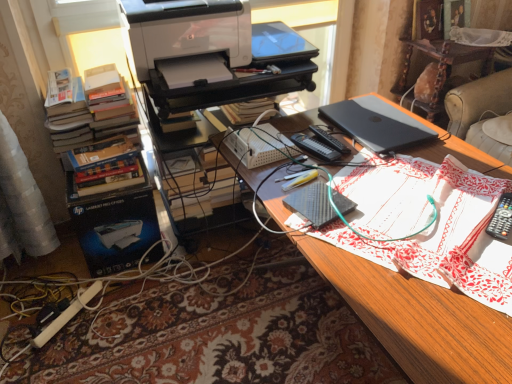
Question: From a real-world perspective, is white matte printer at upper left below black textured notebook at center?

Choices:
 (A) yes
 (B) no

Answer: (B)

Question: Are white matte printer at upper left and black textured notebook at center located far from each other?

Choices:
 (A) yes
 (B) no

Answer: (B)

Question: From the image's perspective, would you say white matte printer at upper left is positioned over black textured notebook at center?

Choices:
 (A) no
 (B) yes

Answer: (B)

Question: From the image's perspective, is white matte printer at upper left under black textured notebook at center?

Choices:
 (A) no
 (B) yes

Answer: (A)

Question: Is black textured notebook at center a part of white matte printer at upper left?

Choices:
 (A) no
 (B) yes

Answer: (A)

Question: Based on their positions, is black matte laptop at upper right located to the left or right of black textured notebook at center?

Choices:
 (A) right
 (B) left

Answer: (A)

Question: Considering their positions, is black matte laptop at upper right located in front of or behind black textured notebook at center?

Choices:
 (A) front
 (B) behind

Answer: (B)

Question: Is point (351, 124) closer or farther from the camera than point (290, 193)?

Choices:
 (A) farther
 (B) closer

Answer: (A)

Question: From the image's perspective, is black matte laptop at upper right above or below black textured notebook at center?

Choices:
 (A) below
 (B) above

Answer: (B)

Question: Is black plastic laptop at upper right, marked as the second computer desk in a left-to-right arrangement, bigger or smaller than white plastic printer at upper center, positioned as the 1th computer desk in left-to-right order?

Choices:
 (A) big
 (B) small

Answer: (B)

Question: Is point pos(432,107) closer or farther from the camera than point pos(294,48)?

Choices:
 (A) closer
 (B) farther

Answer: (B)

Question: From the image's perspective, is black plastic laptop at upper right, which is the 1th computer desk from right to left, above or below white plastic printer at upper center, positioned as the 1th computer desk in left-to-right order?

Choices:
 (A) below
 (B) above

Answer: (B)

Question: From their relative heights in the image, would you say black plastic laptop at upper right, which is the 1th computer desk from right to left, is taller or shorter than white plastic printer at upper center, positioned as the 1th computer desk in left-to-right order?

Choices:
 (A) short
 (B) tall

Answer: (A)

Question: From a real-world perspective, relative to black matte laptop at upper right, is beige leather couch at upper right vertically above or below?

Choices:
 (A) above
 (B) below

Answer: (B)

Question: Is beige leather couch at upper right wider or thinner than black matte laptop at upper right?

Choices:
 (A) thin
 (B) wide

Answer: (B)